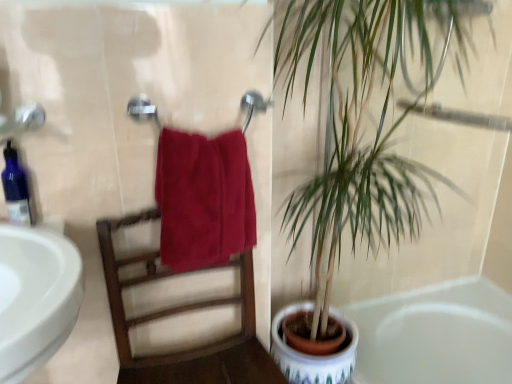
Question: Is wooden chair at center positioned with its back to matte metal towel bar at center?

Choices:
 (A) yes
 (B) no

Answer: (B)

Question: Is wooden chair at center to the right of matte metal towel bar at center from the viewer's perspective?

Choices:
 (A) yes
 (B) no

Answer: (B)

Question: Are wooden chair at center and matte metal towel bar at center making contact?

Choices:
 (A) no
 (B) yes

Answer: (A)

Question: Is wooden chair at center positioned beyond the bounds of matte metal towel bar at center?

Choices:
 (A) yes
 (B) no

Answer: (A)

Question: Is wooden chair at center surrounding matte metal towel bar at center?

Choices:
 (A) yes
 (B) no

Answer: (B)

Question: Is matte metal towel bar at center wider or thinner than white glossy bathtub at lower right?

Choices:
 (A) wide
 (B) thin

Answer: (B)

Question: From the image's perspective, is matte metal towel bar at center located above or below white glossy bathtub at lower right?

Choices:
 (A) below
 (B) above

Answer: (B)

Question: From their relative heights in the image, would you say matte metal towel bar at center is taller or shorter than white glossy bathtub at lower right?

Choices:
 (A) short
 (B) tall

Answer: (B)

Question: Looking at the image, does matte metal towel bar at center seem bigger or smaller compared to white glossy bathtub at lower right?

Choices:
 (A) small
 (B) big

Answer: (A)

Question: Choose the correct answer: Is satin red towel at center inside white glossy bathtub at lower right or outside it?

Choices:
 (A) inside
 (B) outside

Answer: (B)

Question: Looking at the image, does satin red towel at center seem bigger or smaller compared to white glossy bathtub at lower right?

Choices:
 (A) small
 (B) big

Answer: (A)

Question: From a real-world perspective, is satin red towel at center positioned above or below white glossy bathtub at lower right?

Choices:
 (A) below
 (B) above

Answer: (B)

Question: Looking at their shapes, would you say satin red towel at center is wider or thinner than white glossy bathtub at lower right?

Choices:
 (A) thin
 (B) wide

Answer: (A)

Question: Do you think matte metal towel bar at center is within wooden chair at center, or outside of it?

Choices:
 (A) inside
 (B) outside

Answer: (B)

Question: Is matte metal towel bar at center wider or thinner than wooden chair at center?

Choices:
 (A) wide
 (B) thin

Answer: (B)